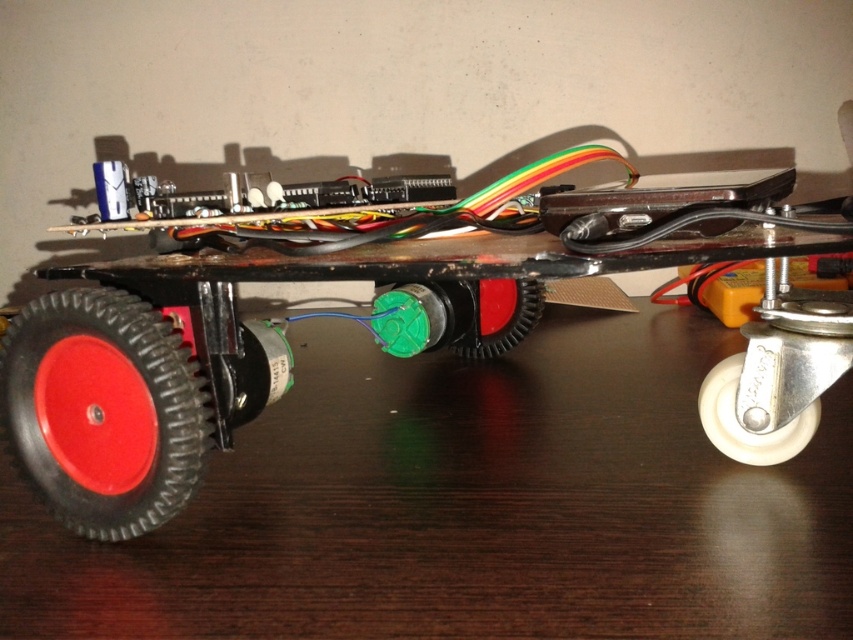
You are a delivery robot that needs to deliver a package to a rubberized black toy car at center. The package must be placed exactly 15 inches away from the toy car. Can you position the package precisely at the required distance?

The distance between the rubberized black toy car at center and the camera is 14.90 inches, so placing the package exactly 15 inches away from the toy car is possible as it is slightly closer than the camera.

You are designing a packaging box for the robot shown in the image. The box must accommodate both the white rubber wheel at lower right and the green rubber wheel at center. Which wheel requires a larger compartment in the box?

The green rubber wheel at center requires a larger compartment because it occupies more space than the white rubber wheel at lower right.